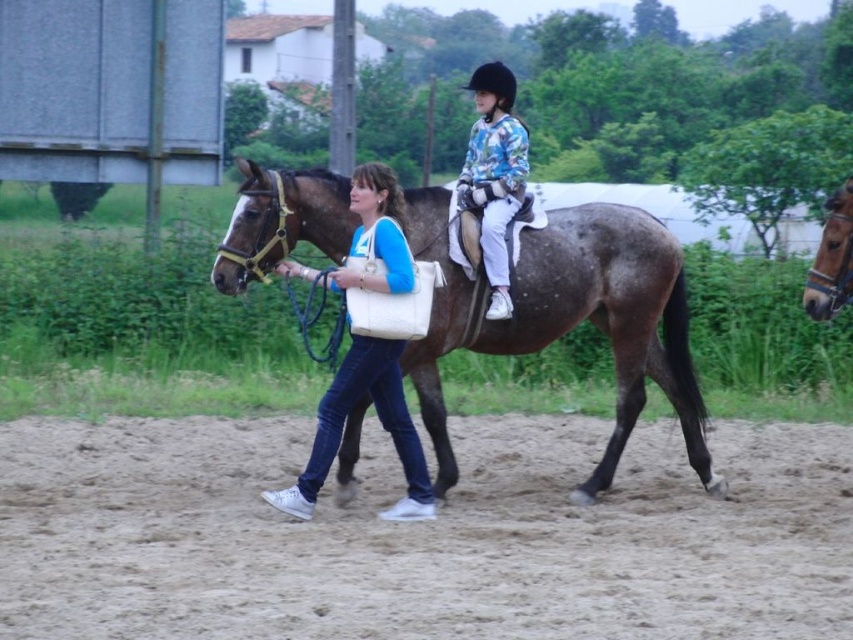
You are standing at the edge of the scene and want to walk towards the brown sandy ground at lower center and the floral jersey at center. Which object will you encounter first as you move forward?

The brown sandy ground at lower center will be encountered first because it is positioned lower and closer to the viewer than the floral jersey at center.

You are standing at the point labeled as point (421, 534) in the image. What is the surface you are standing on?

The point (421, 534) is on brown sandy ground at lower center.